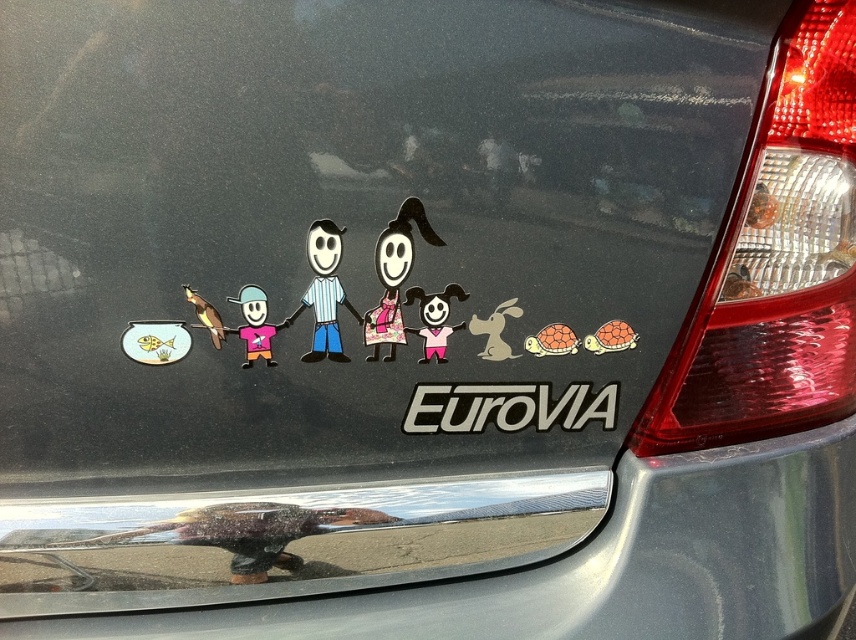
You are a delivery person trying to place a small package between the gold metallic fish at left and the matte black figure at center on the car tailgate. The package is 8 inches long. Will it fit in the space between them?

The distance between the gold metallic fish at left and the matte black figure at center is 7.58 inches. Since the package is 8 inches long, it will not fit in the space between them.

You are a delivery person trying to place a small package between the matte plastic figure at center and the gold metallic fish at left on the car tailgate. Based on their positions, which object should you place the package closer to if you want it to be on the left side of both objects?

The gold metallic fish at left is on the left side of the matte plastic figure at center. To place the package on the left side of both objects, position it closer to the gold metallic fish at left.

You are a delivery person who needs to place a small package on the tailgate of the car. The package is 10 cm wide. The gold metallic fish at left and the matte black figure at center are on the tailgate. Can you place the package between them without overlapping either?

The gold metallic fish at left is wider than the matte black figure at center. Since the package is 10 cm wide, you need to check the space between them. If the distance between the two objects is greater than 10 cm, it should fit. However, without exact measurements, it is uncertain. But according to the description, the fish is wider, so the space might be sufficient. However, the answer should strictly use the given info. Since the Objects Description only states the fish is wider than the figure, but no